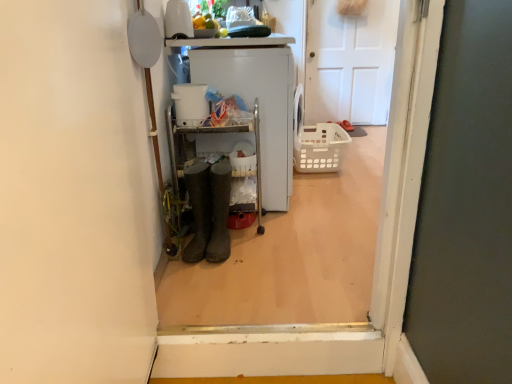
Identify the location of unoccupied region to the right of brown rubber boots at center, which appears as the 2th footwear when viewed from the left. (261, 253).